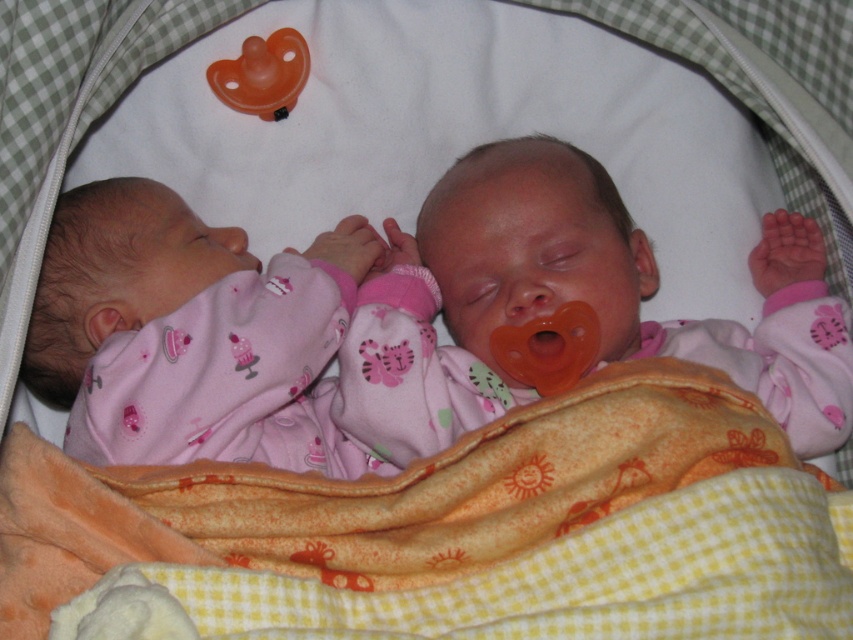
Question: Where is yellow fleece blanket at center located in relation to orange rubber pacifier at center in the image?

Choices:
 (A) above
 (B) below

Answer: (B)

Question: Based on their relative distances, which object is nearer to the orange rubber pacifier at center?

Choices:
 (A) yellow fleece blanket at center
 (B) orange rubber pacifier at upper left

Answer: (A)

Question: Which point is closer to the camera?

Choices:
 (A) (520, 339)
 (B) (270, 35)
 (C) (654, 444)
 (D) (476, 332)

Answer: (C)

Question: Which point is farther to the camera?

Choices:
 (A) [751, 381]
 (B) [540, 328]
 (C) [621, 468]
 (D) [244, 65]

Answer: (D)

Question: Is yellow fleece blanket at center above orange rubber pacifier at center?

Choices:
 (A) yes
 (B) no

Answer: (B)

Question: Observing the image, what is the correct spatial positioning of yellow fleece blanket at center in reference to orange rubber pacifier at upper left?

Choices:
 (A) below
 (B) above

Answer: (A)